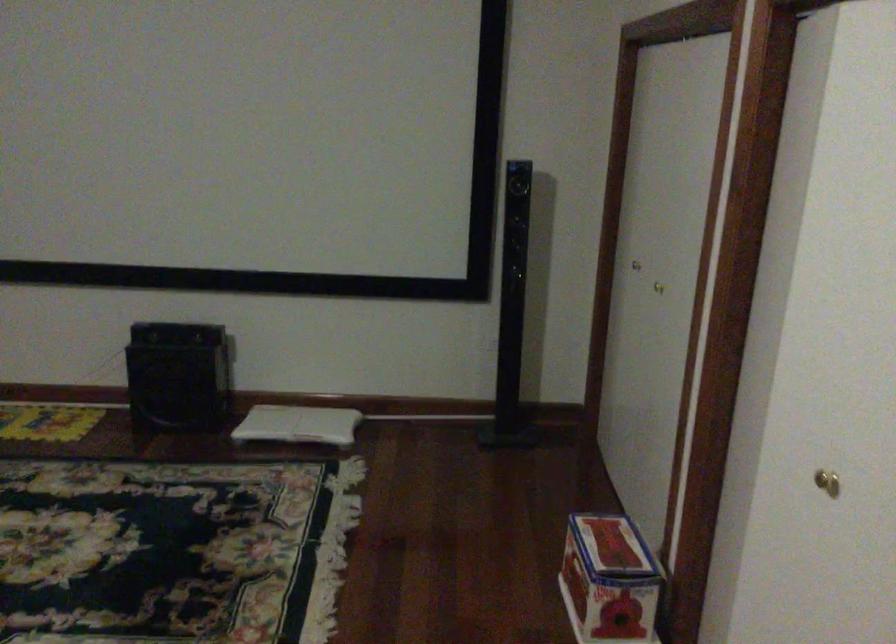
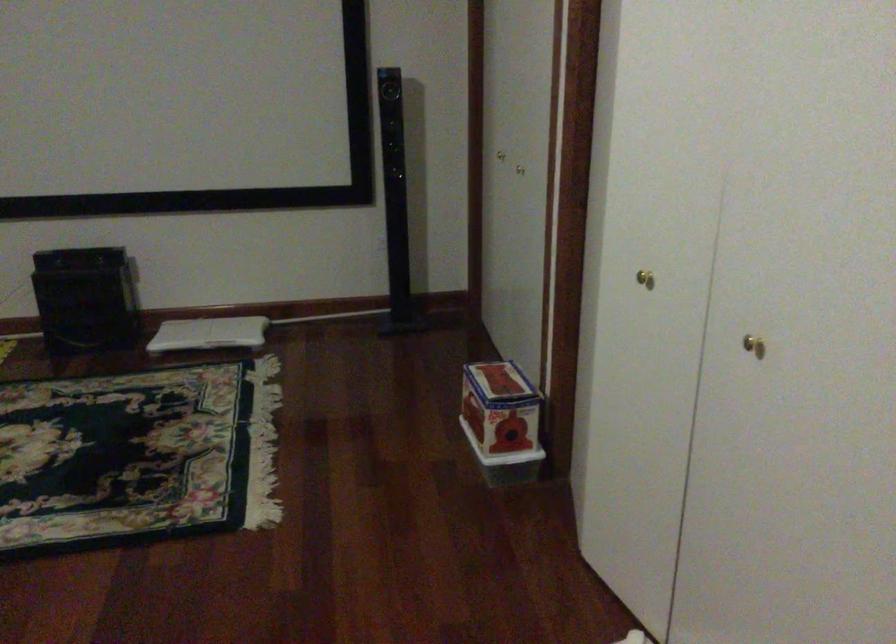
Where in the second image is the point corresponding to the point at 817,466 from the first image?

(644, 279)